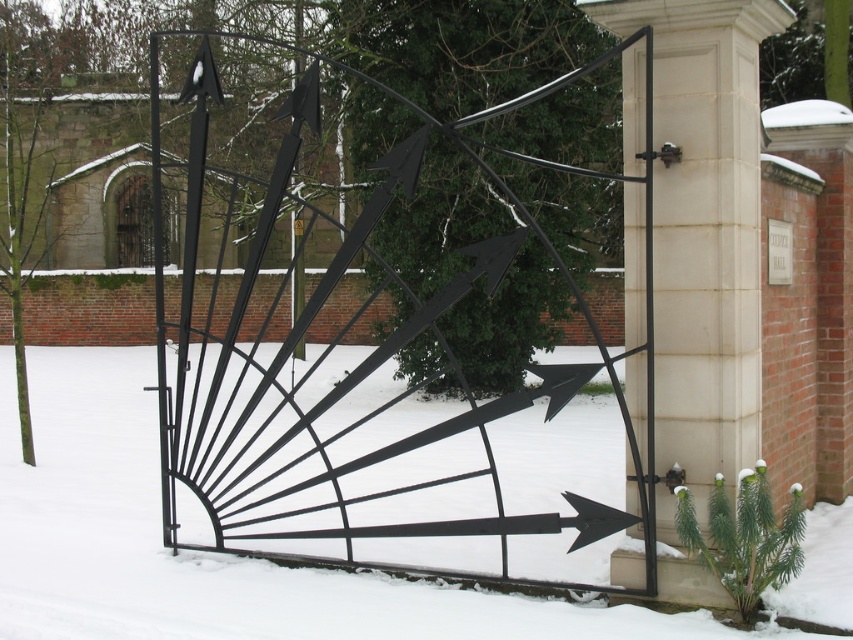
Consider the image. Between white matte snow at center and white stone pillar at center, which one has less height?

Result: With less height is white matte snow at center.

What do you see at coordinates (202, 554) in the screenshot? I see `white matte snow at center` at bounding box center [202, 554].

Locate an element on the screen. The width and height of the screenshot is (853, 640). white matte snow at center is located at coordinates (202, 554).